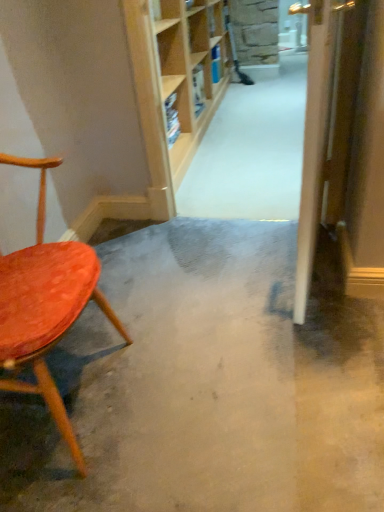
Question: Does wooden door at right lie behind smooth concrete floor at center?

Choices:
 (A) yes
 (B) no

Answer: (A)

Question: Could you tell me if wooden door at right is turned towards smooth concrete floor at center?

Choices:
 (A) yes
 (B) no

Answer: (A)

Question: From the image's perspective, would you say wooden door at right is positioned over smooth concrete floor at center?

Choices:
 (A) no
 (B) yes

Answer: (B)

Question: Is wooden door at right turned away from smooth concrete floor at center?

Choices:
 (A) no
 (B) yes

Answer: (A)

Question: Considering the relative positions of wooden door at right and smooth concrete floor at center in the image provided, is wooden door at right to the right of smooth concrete floor at center from the viewer's perspective?

Choices:
 (A) yes
 (B) no

Answer: (A)

Question: Does wooden door at right have a lesser width compared to smooth concrete floor at center?

Choices:
 (A) no
 (B) yes

Answer: (B)

Question: Can you confirm if wooden door at right is shorter than wooden bookshelf at upper center?

Choices:
 (A) no
 (B) yes

Answer: (A)

Question: Can you confirm if wooden door at right is wider than wooden bookshelf at upper center?

Choices:
 (A) yes
 (B) no

Answer: (B)

Question: Is wooden door at right positioned before wooden bookshelf at upper center?

Choices:
 (A) no
 (B) yes

Answer: (B)

Question: From the image's perspective, does wooden door at right appear higher than wooden bookshelf at upper center?

Choices:
 (A) no
 (B) yes

Answer: (A)

Question: From the image's perspective, would you say wooden door at right is shown under wooden bookshelf at upper center?

Choices:
 (A) yes
 (B) no

Answer: (A)

Question: Can you confirm if wooden door at right is thinner than wooden bookshelf at upper center?

Choices:
 (A) no
 (B) yes

Answer: (B)

Question: Is the surface of velvet orange chair at left in direct contact with smooth concrete floor at center?

Choices:
 (A) no
 (B) yes

Answer: (A)